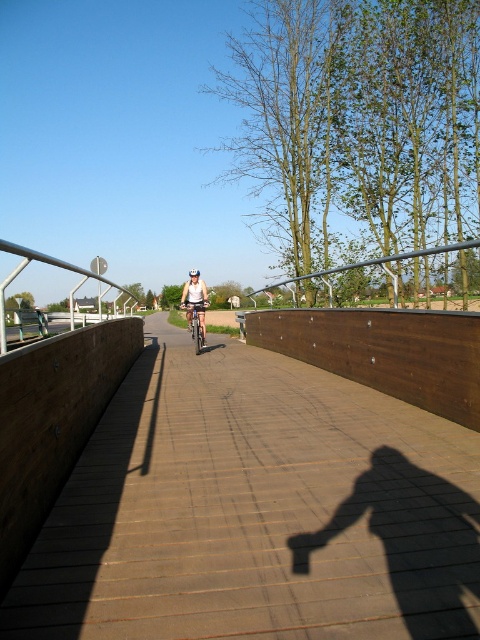
Question: Does brown wooden path at center appear over white matte bicycle helmet at center?

Choices:
 (A) no
 (B) yes

Answer: (A)

Question: Among these points, which one is farthest from the camera?

Choices:
 (A) (183, 289)
 (B) (192, 272)
 (C) (451, 637)

Answer: (B)

Question: Can you confirm if brown wooden path at center is bigger than white matte bicycle helmet at center?

Choices:
 (A) no
 (B) yes

Answer: (A)

Question: Which object is positioned closest to the brown wooden path at center?

Choices:
 (A) white matte bicycle helmet at center
 (B) white matte helmet at center

Answer: (B)

Question: Which point is farther to the camera?

Choices:
 (A) white matte bicycle helmet at center
 (B) brown wooden path at center

Answer: (A)

Question: Does white matte helmet at center appear on the left side of white matte bicycle helmet at center?

Choices:
 (A) no
 (B) yes

Answer: (A)